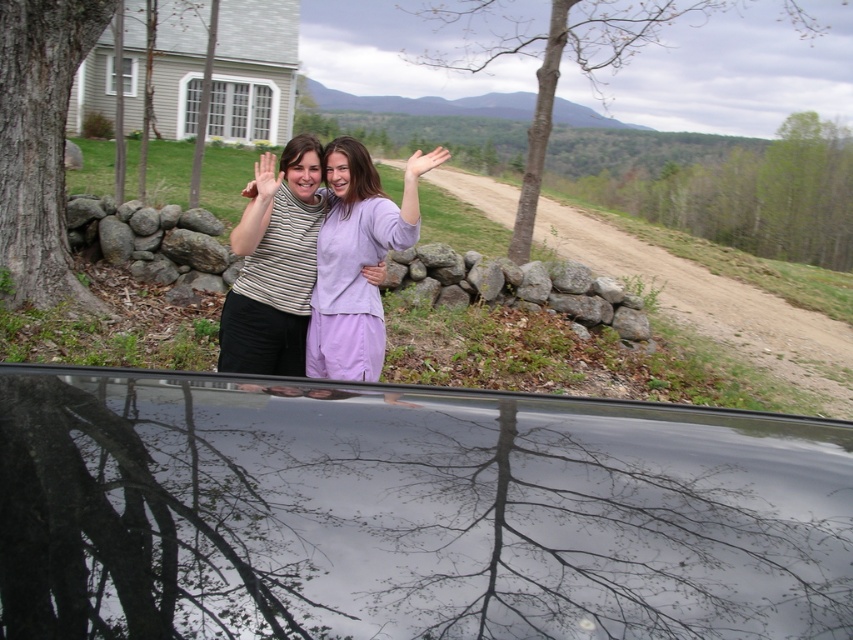
Is smooth gray bark at left above matte purple dress at center?

Indeed, smooth gray bark at left is positioned over matte purple dress at center.

Which of these two, smooth gray bark at left or matte purple dress at center, stands shorter?

matte purple dress at center is shorter.

The width and height of the screenshot is (853, 640). What do you see at coordinates (39, 144) in the screenshot?
I see `smooth gray bark at left` at bounding box center [39, 144].

At what (x,y) coordinates should I click in order to perform the action: click on smooth gray bark at left. Please return your answer as a coordinate pair (x, y). This screenshot has height=640, width=853. Looking at the image, I should click on (39, 144).

Does point (212, 538) come closer to viewer compared to point (265, 173)?

Yes, point (212, 538) is in front of point (265, 173).

Which is more to the right, glossy black car window at center or matte black hand at upper center?

From the viewer's perspective, glossy black car window at center appears more on the right side.

You are a GUI agent. You are given a task and a screenshot of the screen. Output one action in this format:
    pyautogui.click(x=<x>, y=<y>)
    Task: Click on the glossy black car window at center
    
    Given the screenshot: What is the action you would take?
    pyautogui.click(x=409, y=513)

Where is `glossy black car window at center`? This screenshot has width=853, height=640. glossy black car window at center is located at coordinates (409, 513).

Between matte black hand at upper center and matte purple hand at upper center, which one has less height?

Standing shorter between the two is matte black hand at upper center.

Who is more forward, (254, 193) or (437, 157)?

Point (437, 157)

Between point (251, 188) and point (427, 157), which one is positioned in front?

Point (427, 157) is in front.

The image size is (853, 640). In order to click on matte black hand at upper center in this screenshot , I will do `click(263, 179)`.